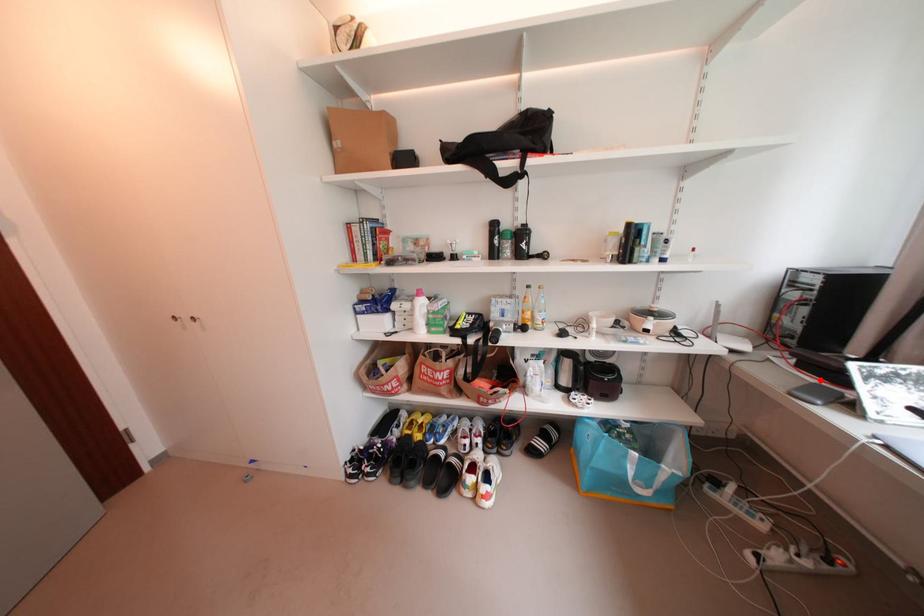
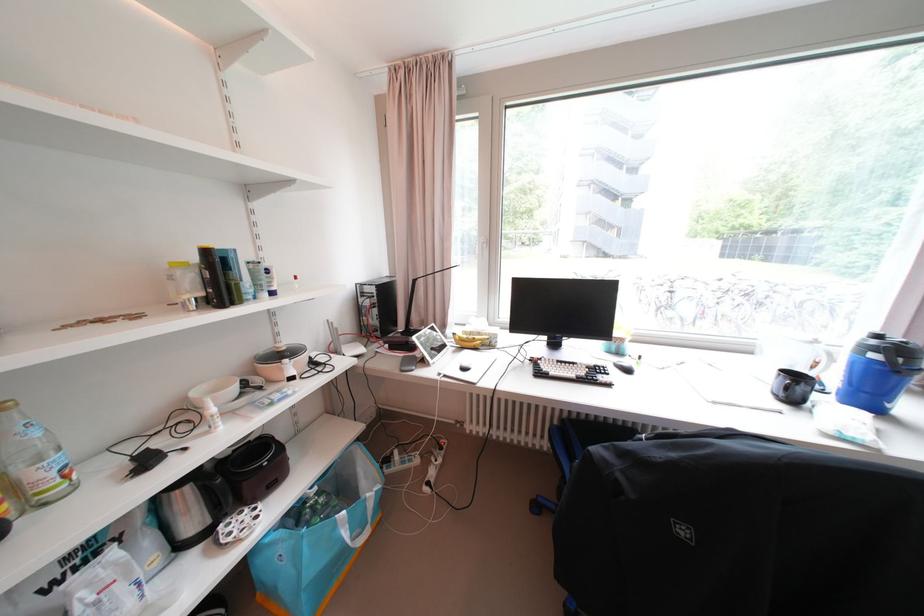
In the second image, find the point that corresponds to the highlighted location in the first image.

(409, 355)